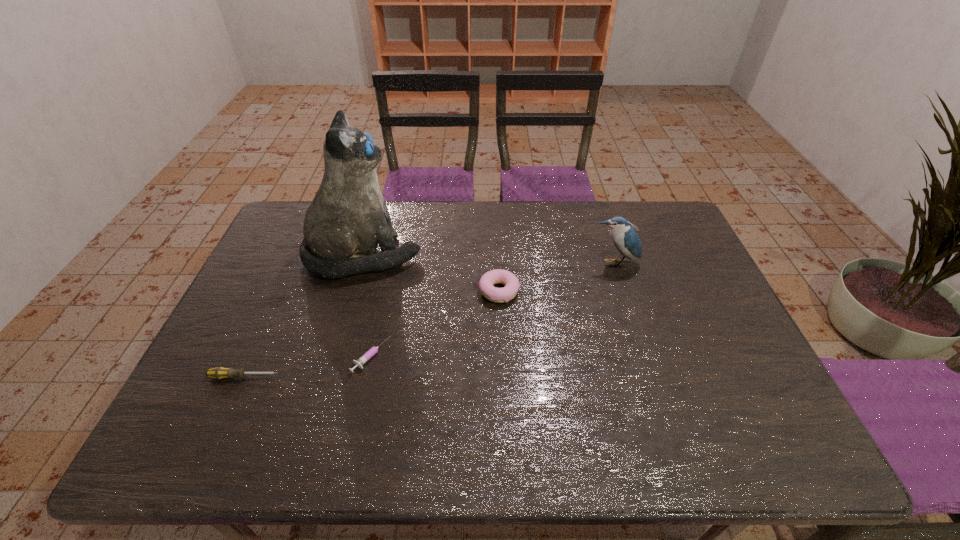
Where is `vacant space at the far right corner`? vacant space at the far right corner is located at coordinates (673, 212).

The image size is (960, 540). I want to click on vacant space that is in between the second tallest object and the shortest object, so click(492, 309).

This screenshot has height=540, width=960. Identify the location of vacant area that lies between the shortest object and the cat. (368, 306).

You are a GUI agent. You are given a task and a screenshot of the screen. Output one action in this format:
    pyautogui.click(x=<x>, y=<y>)
    Task: Click on the free space that is in between the shortest object and the rightmost object
    
    Given the screenshot: What is the action you would take?
    pyautogui.click(x=492, y=309)

Find the location of `empty space between the shortest object and the cat`. empty space between the shortest object and the cat is located at coordinates (368, 306).

The image size is (960, 540). In order to click on free space between the second shortest object and the doughnut in this screenshot , I will do `click(372, 334)`.

Where is `free spot between the tallest object and the second shortest object`? The width and height of the screenshot is (960, 540). free spot between the tallest object and the second shortest object is located at coordinates (304, 316).

Where is `free area in between the third shortest object and the cat`? This screenshot has height=540, width=960. free area in between the third shortest object and the cat is located at coordinates (431, 273).

Locate an element on the screen. The image size is (960, 540). vacant region between the doughnut and the tallest object is located at coordinates (431, 273).

Where is `blank region between the syringe and the rightmost object`? Image resolution: width=960 pixels, height=540 pixels. blank region between the syringe and the rightmost object is located at coordinates (492, 309).